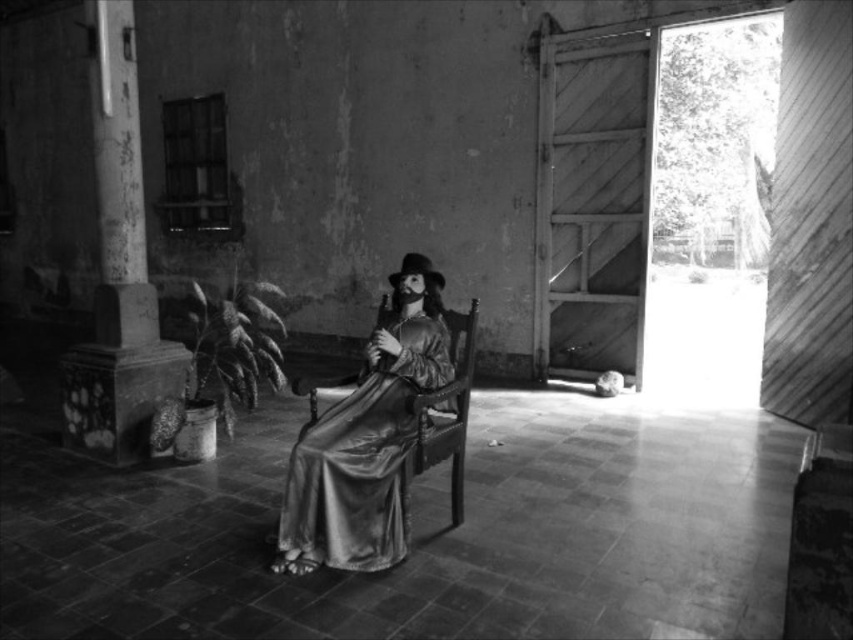
Question: Is silky gold dress at center to the left of smooth stone column at left from the viewer's perspective?

Choices:
 (A) no
 (B) yes

Answer: (A)

Question: Does silky gold dress at center appear on the left side of smooth stone column at left?

Choices:
 (A) no
 (B) yes

Answer: (A)

Question: Which point is farther from the camera taking this photo?

Choices:
 (A) click(390, 483)
 (B) click(115, 332)

Answer: (B)

Question: Among these objects, which one is nearest to the camera?

Choices:
 (A) smooth stone column at left
 (B) silky gold dress at center

Answer: (B)

Question: Which of the following is the closest to the observer?

Choices:
 (A) (138, 205)
 (B) (294, 572)

Answer: (B)

Question: Can you confirm if silky gold dress at center is positioned below smooth stone column at left?

Choices:
 (A) no
 (B) yes

Answer: (B)